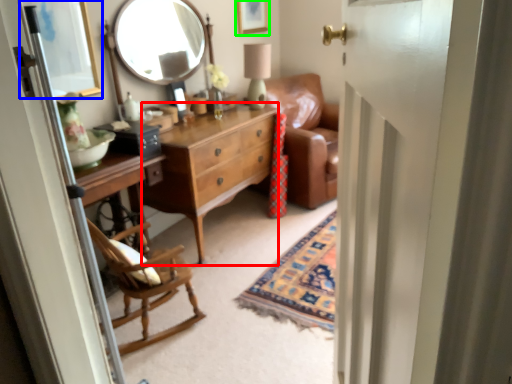
Question: Considering the real-world distances, which object is closest to cabinetry (highlighted by a red box)? picture frame (highlighted by a blue box) or picture frame (highlighted by a green box).

Choices:
 (A) picture frame
 (B) picture frame

Answer: (A)